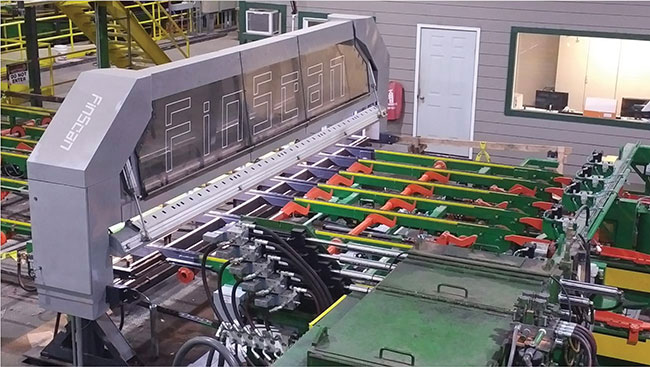
Where is `top of door frame`? This screenshot has width=650, height=367. top of door frame is located at coordinates (450, 27).